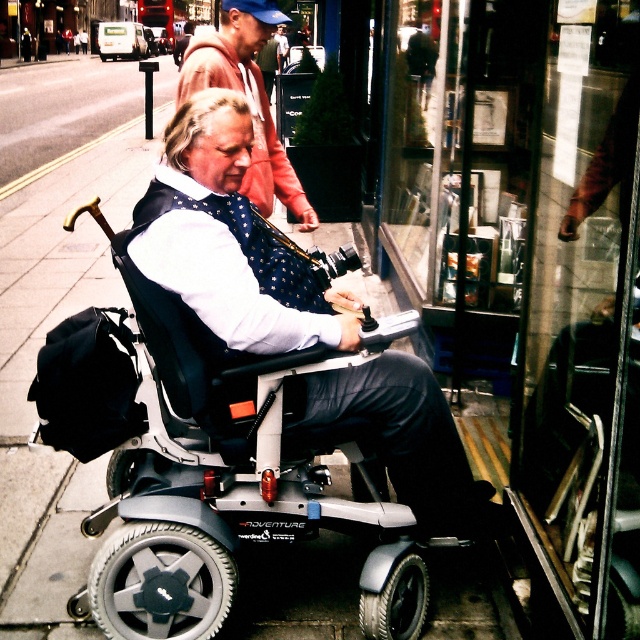
Question: Estimate the real-world distances between objects in this image. Which object is closer to the polka dot bow tie at center?

Choices:
 (A) matte black wheelchair at center
 (B) glassy reflective window at center

Answer: (A)

Question: Can you confirm if glassy reflective window at center is wider than matte black wheelchair at center?

Choices:
 (A) no
 (B) yes

Answer: (A)

Question: Does glassy reflective window at center lie behind polka dot bow tie at center?

Choices:
 (A) yes
 (B) no

Answer: (A)

Question: Is matte black wheelchair at center above polka dot bow tie at center?

Choices:
 (A) yes
 (B) no

Answer: (B)

Question: Which of the following is the farthest from the observer?

Choices:
 (A) glassy reflective window at center
 (B) matte black wheelchair at center
 (C) polka dot bow tie at center

Answer: (A)

Question: Which object is closer to the camera taking this photo?

Choices:
 (A) glassy reflective window at center
 (B) matte black wheelchair at center

Answer: (B)